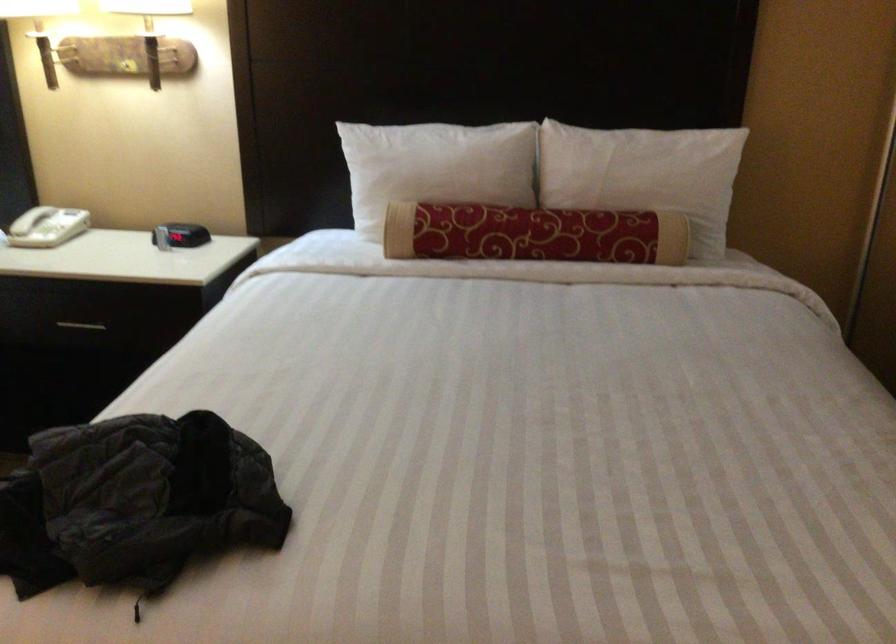
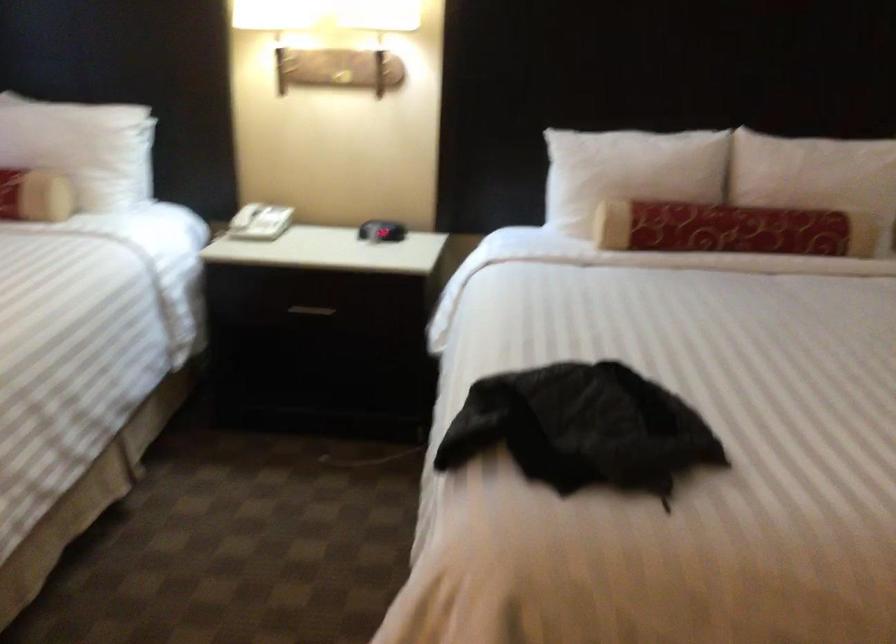
Question: The camera is either moving clockwise (left) or counter-clockwise (right) around the object. The first image is from the beginning of the video and the second image is from the end. Is the camera moving left or right when shooting the video?

Choices:
 (A) Left
 (B) Right

Answer: (B)